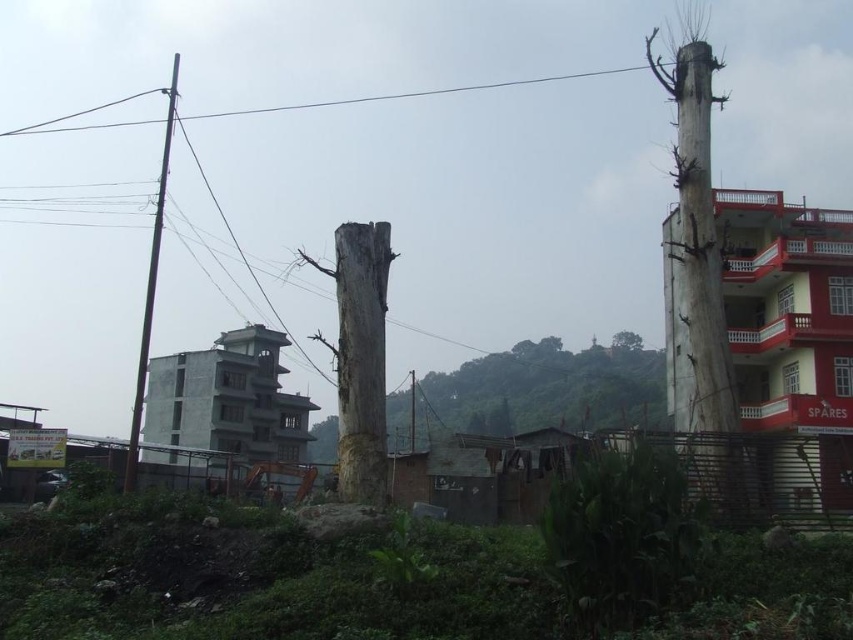
From the picture: Who is taller, smooth gray tree trunk at center or metallic wire at upper center?

With more height is smooth gray tree trunk at center.

Does smooth gray tree trunk at center lie behind metallic wire at upper center?

No, smooth gray tree trunk at center is closer to the viewer.

Is point (503, 372) closer to viewer compared to point (286, 106)?

Yes.

Locate an element on the screen. The height and width of the screenshot is (640, 853). smooth gray tree trunk at center is located at coordinates (546, 388).

Is point (364, 252) farther from viewer compared to point (318, 106)?

No.

Which is in front, point (361, 289) or point (538, 81)?

Point (361, 289) is more forward.

Who is more distant from viewer, (384,346) or (405,93)?

Positioned behind is point (405,93).

The height and width of the screenshot is (640, 853). I want to click on gray rough tree trunk at center, so click(x=360, y=356).

Is smooth gray tree trunk at center behind gray rough tree trunk at center?

Yes, smooth gray tree trunk at center is behind gray rough tree trunk at center.

Is smooth gray tree trunk at center in front of gray rough tree trunk at center?

No, it is behind gray rough tree trunk at center.

Is point (395, 400) more distant than point (335, 285)?

Yes, it is behind point (335, 285).

Find the location of `smooth gray tree trunk at center`. smooth gray tree trunk at center is located at coordinates (546, 388).